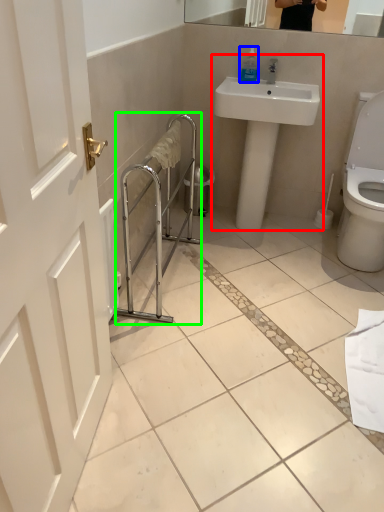
Question: Which is nearer to the sink (highlighted by a red box)? soap dispenser (highlighted by a blue box) or balustrade (highlighted by a green box).

Choices:
 (A) soap dispenser
 (B) balustrade

Answer: (A)